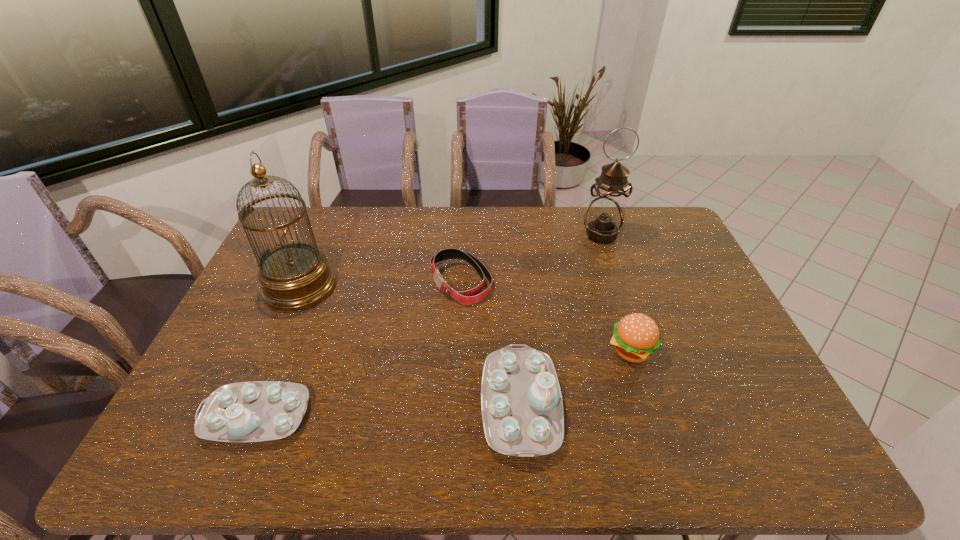
Locate an element on the screen. The width and height of the screenshot is (960, 540). free spot between the dog collar and the taller chinaware is located at coordinates pyautogui.click(x=491, y=343).

Where is `unoccupied area between the shorter chinaware and the oil lamp`? unoccupied area between the shorter chinaware and the oil lamp is located at coordinates (429, 326).

At what (x,y) coordinates should I click in order to perform the action: click on vacant space that's between the shorter chinaware and the birdcage. Please return your answer as a coordinate pair (x, y). The width and height of the screenshot is (960, 540). Looking at the image, I should click on (278, 352).

Locate an element on the screen. The image size is (960, 540). vacant space that's between the left chinaware and the shortest object is located at coordinates (359, 349).

At what (x,y) coordinates should I click in order to perform the action: click on free area in between the farthest object and the hamburger. Please return your answer as a coordinate pair (x, y). The image size is (960, 540). Looking at the image, I should click on (616, 292).

I want to click on free spot between the farthest object and the right chinaware, so click(561, 320).

Identify the location of unoccupied position between the left chinaware and the taller chinaware. (389, 410).

The width and height of the screenshot is (960, 540). I want to click on unoccupied area between the taller chinaware and the hamburger, so click(576, 377).

Find the location of a particular element. empty space that is in between the hamburger and the oil lamp is located at coordinates (616, 292).

Identify the location of vacant point located between the hamburger and the right chinaware. The image size is (960, 540). (576, 377).